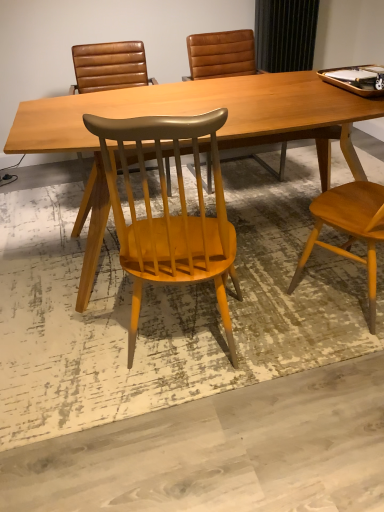
Question: From a real-world perspective, is light brown wood desk at center located higher than brown leather chair at upper center, which appears as the second chair when viewed from the front?

Choices:
 (A) yes
 (B) no

Answer: (B)

Question: Is light brown wood desk at center to the right of brown leather chair at upper center, which is the second chair from back to front, from the viewer's perspective?

Choices:
 (A) yes
 (B) no

Answer: (A)

Question: Does light brown wood desk at center come in front of brown leather chair at upper center, which is the second chair from back to front?

Choices:
 (A) yes
 (B) no

Answer: (A)

Question: From the image's perspective, is light brown wood desk at center over brown leather chair at upper center, which appears as the second chair when viewed from the front?

Choices:
 (A) yes
 (B) no

Answer: (B)

Question: Does light brown wood desk at center appear on the left side of brown leather chair at upper center, which is the second chair from back to front?

Choices:
 (A) yes
 (B) no

Answer: (B)

Question: Considering the positions of point (279, 97) and point (198, 64), is point (279, 97) closer or farther from the camera than point (198, 64)?

Choices:
 (A) closer
 (B) farther

Answer: (A)

Question: From the image's perspective, is light brown wood desk at center positioned above or below matte brown leather chair at center, which is the third chair in front-to-back order?

Choices:
 (A) above
 (B) below

Answer: (B)

Question: Considering their positions, is light brown wood desk at center located in front of or behind matte brown leather chair at center, the 1th chair when ordered from back to front?

Choices:
 (A) behind
 (B) front

Answer: (B)

Question: Looking at the image, does light brown wood desk at center seem bigger or smaller compared to matte brown leather chair at center, which is the third chair in front-to-back order?

Choices:
 (A) big
 (B) small

Answer: (A)

Question: From a real-world perspective, is matte wood chair at center, positioned as the 1th chair in front-to-back order, positioned above or below matte brown leather chair at center, the 1th chair when ordered from back to front?

Choices:
 (A) above
 (B) below

Answer: (A)

Question: Is point (147, 262) closer or farther from the camera than point (317, 155)?

Choices:
 (A) closer
 (B) farther

Answer: (A)

Question: In terms of height, does matte wood chair at center, positioned as the 1th chair in front-to-back order, look taller or shorter compared to matte brown leather chair at center, the 1th chair when ordered from back to front?

Choices:
 (A) short
 (B) tall

Answer: (B)

Question: In the image, is matte wood chair at center, positioned as the 1th chair in front-to-back order, positioned in front of or behind matte brown leather chair at center, the 1th chair when ordered from back to front?

Choices:
 (A) front
 (B) behind

Answer: (A)

Question: From a real-world perspective, relative to matte brown leather chair at center, which is the third chair in front-to-back order, is brown leather chair at upper center, which is the second chair from back to front, vertically above or below?

Choices:
 (A) above
 (B) below

Answer: (A)

Question: Relative to matte brown leather chair at center, the 1th chair when ordered from back to front, is brown leather chair at upper center, which appears as the second chair when viewed from the front, in front or behind?

Choices:
 (A) front
 (B) behind

Answer: (A)